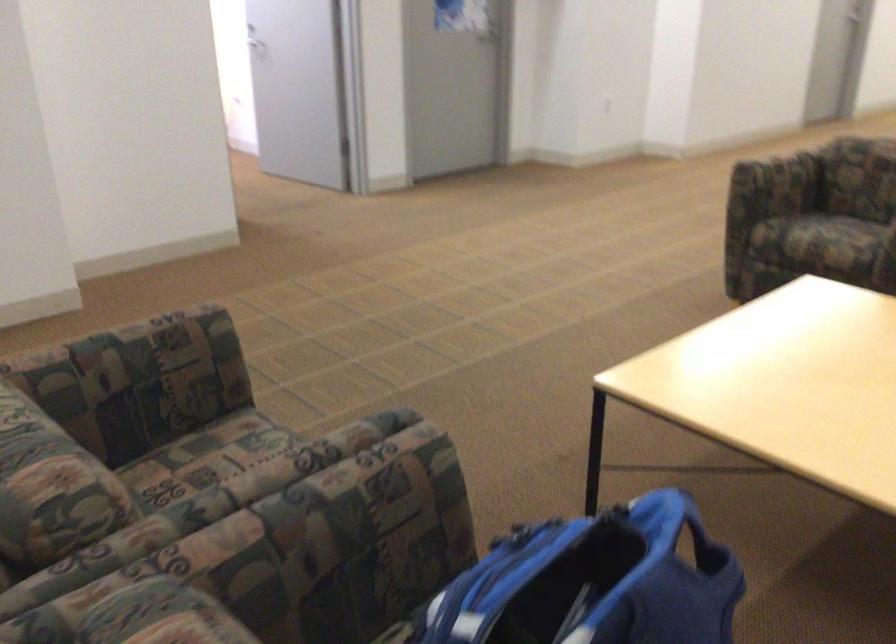
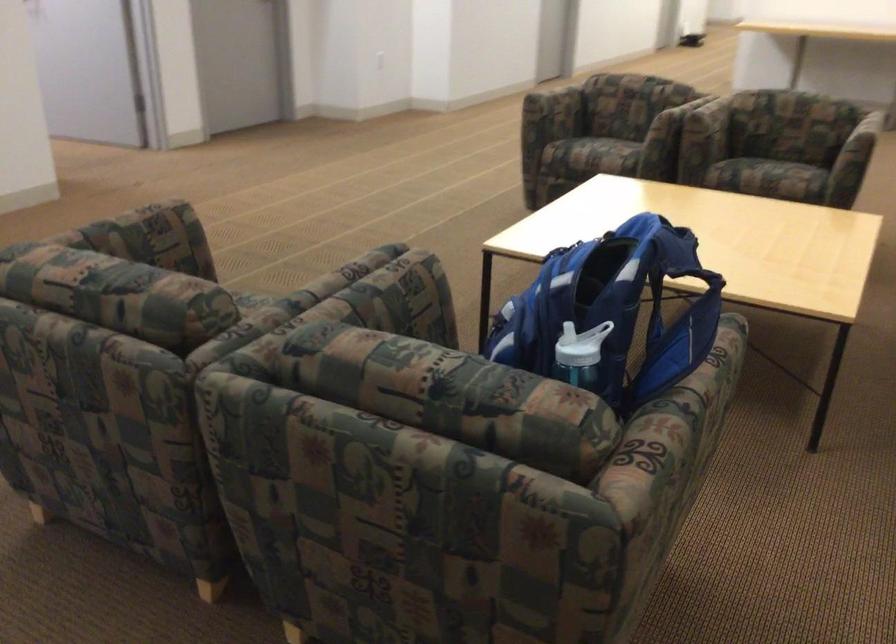
The point at (144, 350) is marked in the first image. Where is the corresponding point in the second image?

(141, 232)